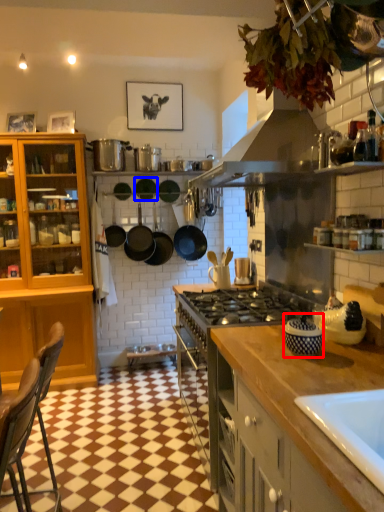
Question: Which of the following is the farthest to the observer, appliance (highlighted by a red box) or frying pan (highlighted by a blue box)?

Choices:
 (A) appliance
 (B) frying pan

Answer: (B)